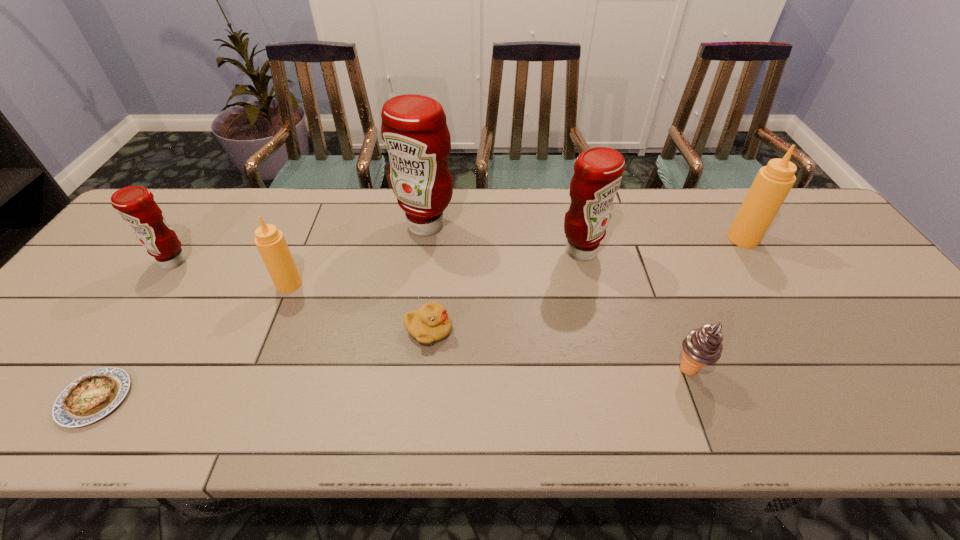
Image resolution: width=960 pixels, height=540 pixels. Identify the location of free space between the seventh object from left to right and the nearest condiment. (489, 327).

Find the location of a particular element. free spot between the farther tan condiment and the second condiment from left to right is located at coordinates (516, 261).

Locate an element on the screen. object that is the seventh closest to the third condiment from left to right is located at coordinates (773, 182).

The image size is (960, 540). I want to click on object that is the closest to the biggest red condiment, so click(x=270, y=242).

Locate which condiment is the closest to the leftmost red condiment. Please provide its 2D coordinates. Your answer should be formatted as a tuple, i.e. [(x, y)], where the tuple contains the x and y coordinates of a point satisfying the conditions above.

[(270, 242)]

You are a GUI agent. You are given a task and a screenshot of the screen. Output one action in this format:
    pyautogui.click(x=<x>, y=<y>)
    Task: Click on the closest condiment relative to the yellow duckling
    
    Given the screenshot: What is the action you would take?
    pyautogui.click(x=414, y=131)

Locate an element on the screen. red condiment object that ranks as the third closest to the nearer tan condiment is located at coordinates (598, 171).

Locate which red condiment ranks in proximity to the leftmost condiment. Please provide its 2D coordinates. Your answer should be formatted as a tuple, i.e. [(x, y)], where the tuple contains the x and y coordinates of a point satisfying the conditions above.

[(414, 131)]

The image size is (960, 540). In order to click on blank space that satisfies the following two spatial constraints: 1. on the front side of the icecream; 2. on the left side of the smaller tan condiment in this screenshot , I will do `click(254, 369)`.

Find the location of `free space that satisfies the following two spatial constraints: 1. on the back side of the rightmost object; 2. on the right side of the second object from right to left`. free space that satisfies the following two spatial constraints: 1. on the back side of the rightmost object; 2. on the right side of the second object from right to left is located at coordinates (639, 238).